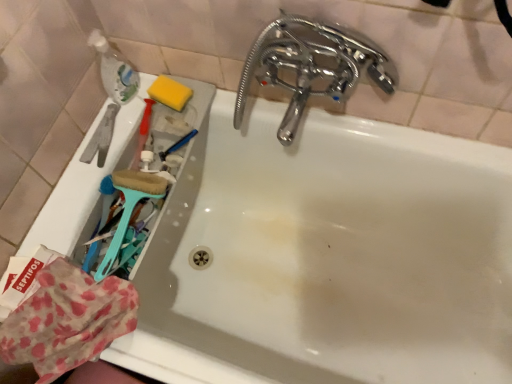
I want to click on empty space that is ontop of polka dot fabric at lower left (from a real-world perspective), so click(x=63, y=311).